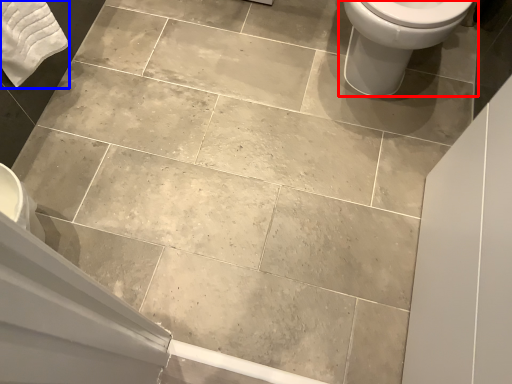
Question: Which of the following is the farthest to the observer, toilet (highlighted by a red box) or bath towel (highlighted by a blue box)?

Choices:
 (A) toilet
 (B) bath towel

Answer: (B)